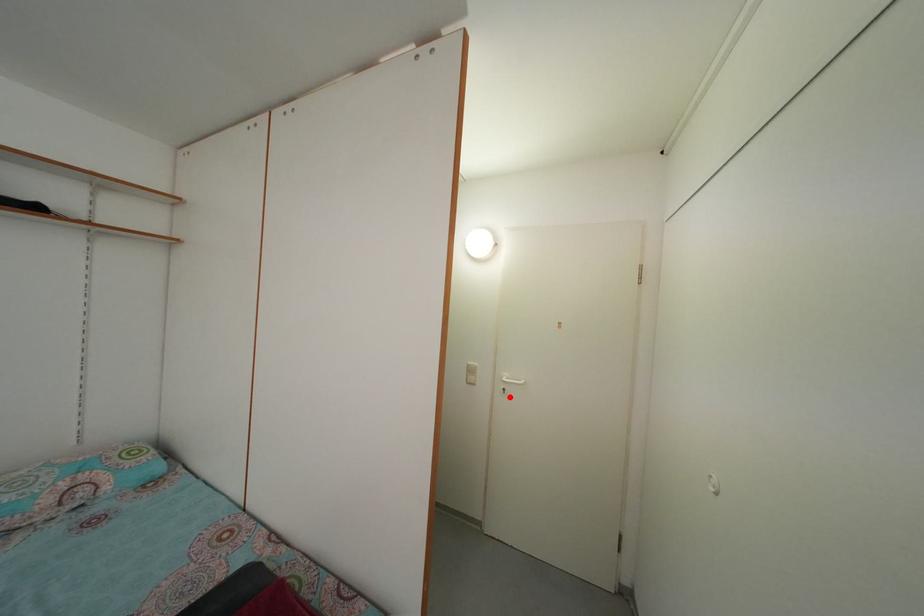
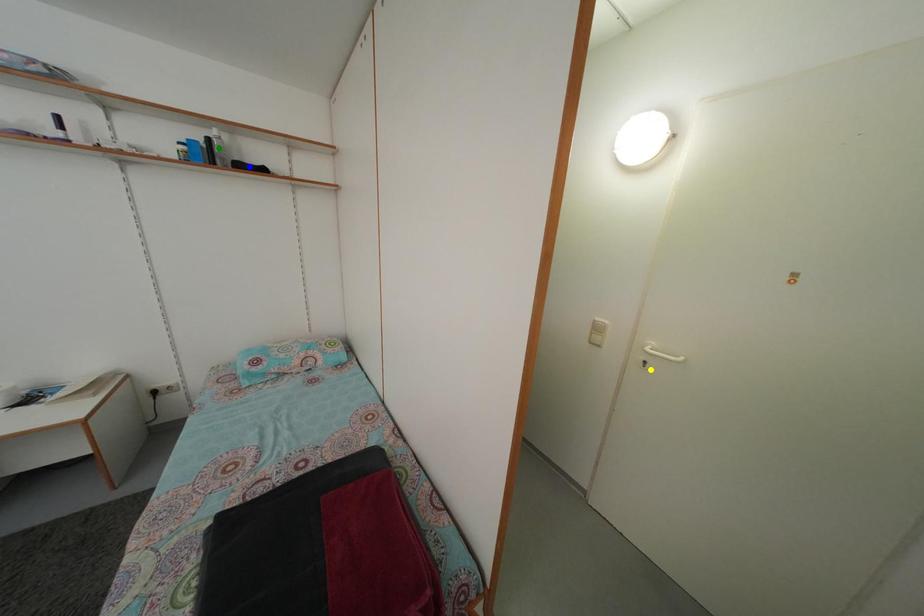
Question: I am providing you with two images of the same scene from different viewpoints. A red point is marked on the first image. You are given multiple points on the second image. Which point in image 2 represents the same 3d spot as the red point in image 1?

Choices:
 (A) green point
 (B) blue point
 (C) yellow point

Answer: (C)